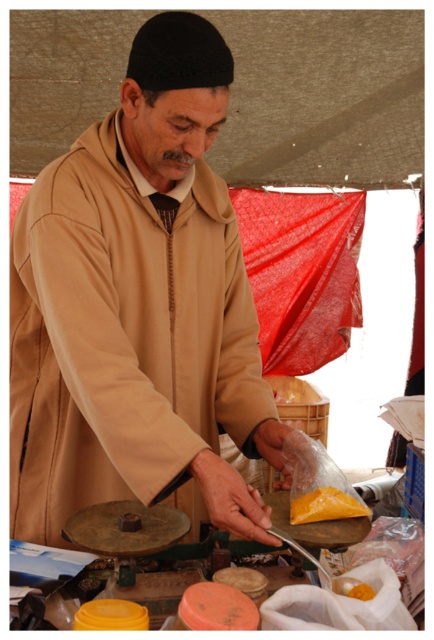
Is the position of yellow powder at center less distant than that of orange powder at center?

No, it is not.

Can you confirm if yellow powder at center is smaller than orange powder at center?

Actually, yellow powder at center might be larger than orange powder at center.

Describe the element at coordinates (325, 506) in the screenshot. I see `yellow powder at center` at that location.

The height and width of the screenshot is (640, 434). In order to click on yellow powder at center in this screenshot , I will do `click(325, 506)`.

Does point (55, 276) come farther from viewer compared to point (348, 595)?

Yes.

Which is behind, point (13, 454) or point (364, 596)?

The point (13, 454) is more distant.

In order to click on beige fabric man at center in this screenshot , I will do `click(138, 308)`.

Between beige fabric man at center and yellow powder at center, which one has less height?

yellow powder at center is shorter.

Can you confirm if beige fabric man at center is bigger than yellow powder at center?

Yes.

Is point (16, 385) farther from viewer compared to point (302, 506)?

Yes, it is behind point (302, 506).

Identify the location of beige fabric man at center. (138, 308).